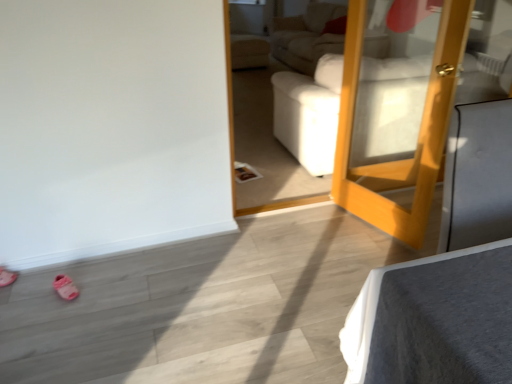
Question: Is point pyautogui.click(x=7, y=273) positioned closer to the camera than point pyautogui.click(x=432, y=71)?

Choices:
 (A) farther
 (B) closer

Answer: (A)

Question: Is pink rubber shoe at lower left, arranged as the 1th shoe when viewed from the left, in front of or behind wooden mirror at right in the image?

Choices:
 (A) behind
 (B) front

Answer: (A)

Question: Estimate the real-world distances between objects in this image. Which object is farther from the pink rubber shoe at lower left, marked as the second shoe in a right-to-left arrangement?

Choices:
 (A) wooden mirror at right
 (B) pink fabric shoe at lower left, acting as the second shoe starting from the left

Answer: (A)

Question: Considering the real-world distances, which object is farthest from the wooden mirror at right?

Choices:
 (A) pink rubber shoe at lower left, marked as the second shoe in a right-to-left arrangement
 (B) pink fabric shoe at lower left, acting as the second shoe starting from the left

Answer: (A)